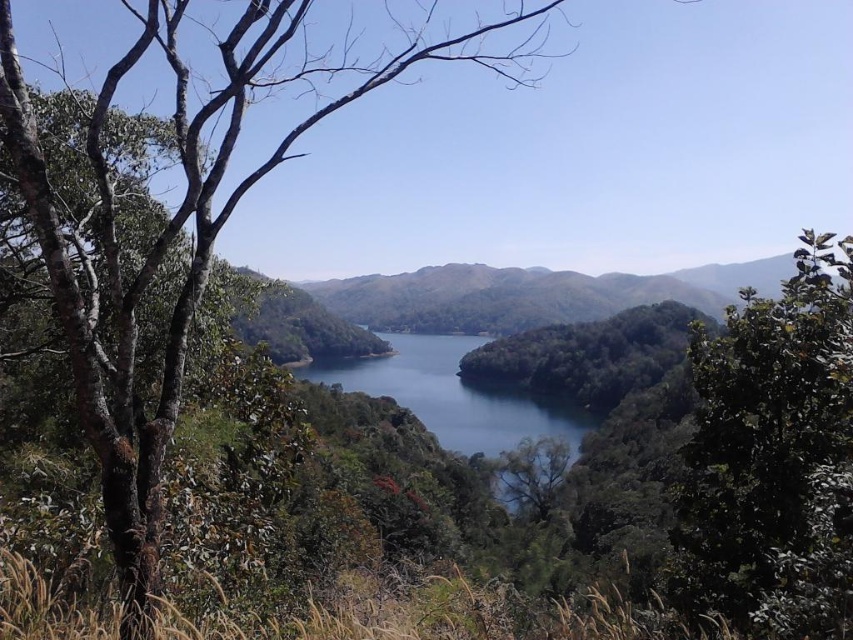
You are planning to place a small wooden bench in the scene. The bench requires a space wider than the dark green leafy tree at center. Can the blue glassy water at center provide enough space for the bench?

The blue glassy water at center is wider than the dark green leafy tree at center, so yes, the bench can be placed there as it has sufficient width.

You are standing at the origin point in the scene. Which direction should you move to reach the blue glassy water at center?

The blue glassy water at center is located at point 0.619 in the x coordinate and 0.532 in the y coordinate, so you should move towards the right and slightly forward to reach it.

You are standing at the edge of the blue glassy water at center and want to walk towards the green leafy tree at left. Which direction should you face to walk directly towards it?

The green leafy tree at left is positioned on the right side of blue glassy water at center, so you should face to the right to walk directly towards the green leafy tree at left.